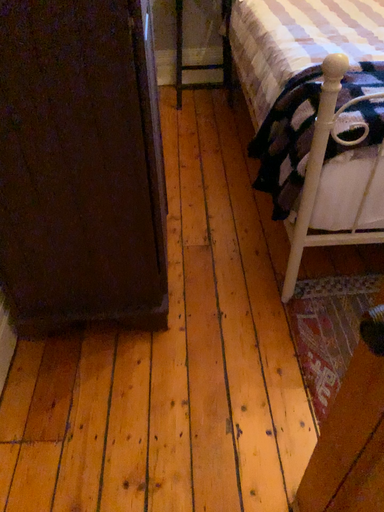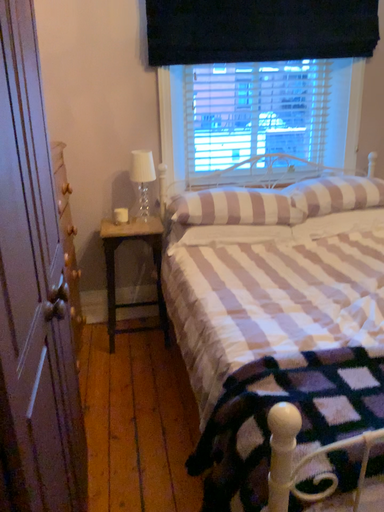
Question: How did the camera likely rotate when shooting the video?

Choices:
 (A) rotated downward
 (B) rotated upward

Answer: (B)